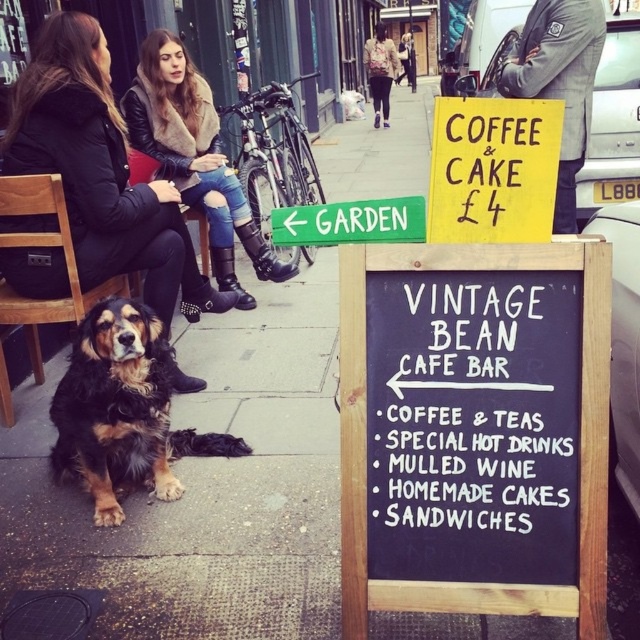
Question: Is leather jacket at upper left above green wooden sign at lower left?

Choices:
 (A) yes
 (B) no

Answer: (A)

Question: Can you confirm if leather jacket at upper left is positioned to the left of leather jacket at upper center?

Choices:
 (A) no
 (B) yes

Answer: (B)

Question: Which of the following is the closest to the observer?

Choices:
 (A) fluffy brown-black dog at lower left
 (B) leather jacket at upper left
 (C) yellow paper sign at upper center
 (D) black chalkboard at center

Answer: (D)

Question: Does fluffy brown-black dog at lower left have a greater width compared to leather jacket at upper left?

Choices:
 (A) yes
 (B) no

Answer: (B)

Question: Among these points, which one is farthest from the camera?

Choices:
 (A) (500, 593)
 (B) (208, 294)
 (C) (372, 209)

Answer: (B)

Question: Estimate the real-world distances between objects in this image. Which object is closer to the leather jacket at upper center?

Choices:
 (A) green wooden sign at lower left
 (B) leather jacket at upper left

Answer: (B)